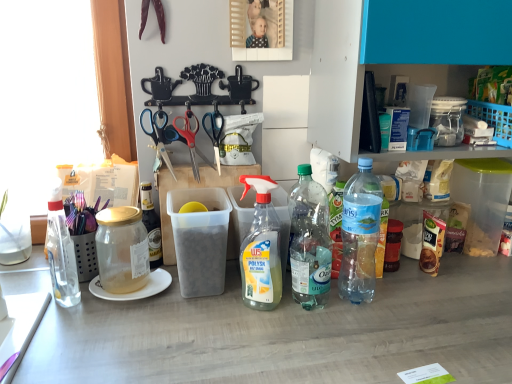
You are a GUI agent. You are given a task and a screenshot of the screen. Output one action in this format:
    pyautogui.click(x=<x>, y=<y>)
    Task: Click on the white ceramic plate at left
    Image resolution: width=512 pixels, height=384 pixels.
    Given the screenshot: What is the action you would take?
    pyautogui.click(x=137, y=290)

In order to face clear plastic bottle at center-right, placed as the 2th bottle when sorted from right to left, should I rotate leftwards or rightwards?

Rotate your view right by about 7.245°.

What do you see at coordinates (214, 133) in the screenshot? Image resolution: width=512 pixels, height=384 pixels. I see `black plastic scissors at center, the first scissors in the right-to-left sequence` at bounding box center [214, 133].

Measure the distance between point (263,241) and camera.

Point (263,241) is 37.48 inches away from camera.

The width and height of the screenshot is (512, 384). What do you see at coordinates (360, 234) in the screenshot?
I see `clear plastic bottle at center-right, the 1th bottle viewed from the right` at bounding box center [360, 234].

The height and width of the screenshot is (384, 512). In order to click on white ceramic plate at left in this screenshot , I will do `click(137, 290)`.

Considering the sizes of objects clear plastic bottle at center-right, marked as the 5th bottle in a left-to-right arrangement, and black plastic scissors at center, the first scissors in the right-to-left sequence, in the image provided, who is shorter, clear plastic bottle at center-right, marked as the 5th bottle in a left-to-right arrangement, or black plastic scissors at center, the first scissors in the right-to-left sequence,?

With less height is black plastic scissors at center, the first scissors in the right-to-left sequence.

Is clear plastic bottle at center-right, the 1th bottle viewed from the right, oriented towards black plastic scissors at center, the first scissors in the right-to-left sequence?

No.

Looking at this image, which is more to the right, clear plastic bottle at center-right, marked as the 5th bottle in a left-to-right arrangement, or black plastic scissors at center, the first scissors in the right-to-left sequence?

clear plastic bottle at center-right, marked as the 5th bottle in a left-to-right arrangement, is more to the right.

Can you tell me how much clear plastic bottle at center-right, the 1th bottle viewed from the right, and black plastic scissors at center, placed as the 3th scissors when sorted from left to right, differ in facing direction?

The angular difference between clear plastic bottle at center-right, the 1th bottle viewed from the right, and black plastic scissors at center, placed as the 3th scissors when sorted from left to right, is 22.5 degrees.

Can you confirm if clear plastic bottle at center-right, the 1th bottle viewed from the right, is taller than clear glass bottle at left, marked as the first bottle in a left-to-right arrangement?

Correct, clear plastic bottle at center-right, the 1th bottle viewed from the right, is much taller as clear glass bottle at left, marked as the first bottle in a left-to-right arrangement.

Considering their positions, is clear plastic bottle at center-right, marked as the 5th bottle in a left-to-right arrangement, located in front of or behind clear glass bottle at left, the fifth bottle in the right-to-left sequence?

In the image, clear plastic bottle at center-right, marked as the 5th bottle in a left-to-right arrangement, appears behind clear glass bottle at left, the fifth bottle in the right-to-left sequence.

From the image's perspective, is clear plastic bottle at center-right, the 1th bottle viewed from the right, on clear glass bottle at left, marked as the first bottle in a left-to-right arrangement?

Yes, from the image's perspective, clear plastic bottle at center-right, the 1th bottle viewed from the right, is on top of clear glass bottle at left, marked as the first bottle in a left-to-right arrangement.

How far apart are white ceramic plate at left and black plastic scissors at center, the first scissors in the right-to-left sequence?

14.84 inches.

Is white ceramic plate at left aimed at black plastic scissors at center, placed as the 3th scissors when sorted from left to right?

No, white ceramic plate at left is not aimed at black plastic scissors at center, placed as the 3th scissors when sorted from left to right.

Who is taller, white ceramic plate at left or black plastic scissors at center, the first scissors in the right-to-left sequence?

black plastic scissors at center, the first scissors in the right-to-left sequence.

Is white ceramic plate at left smaller than black plastic scissors at center, the first scissors in the right-to-left sequence?

Actually, white ceramic plate at left might be larger than black plastic scissors at center, the first scissors in the right-to-left sequence.

Considering the sizes of objects clear plastic bottle at center-right, the 1th bottle viewed from the right, and clear plastic bottle at center-right, which is counted as the 4th bottle, starting from the left, in the image provided, who is smaller, clear plastic bottle at center-right, the 1th bottle viewed from the right, or clear plastic bottle at center-right, which is counted as the 4th bottle, starting from the left,?

With smaller size is clear plastic bottle at center-right, which is counted as the 4th bottle, starting from the left.

Considering the relative sizes of clear plastic bottle at center-right, the 1th bottle viewed from the right, and clear plastic bottle at center-right, placed as the 2th bottle when sorted from right to left, in the image provided, is clear plastic bottle at center-right, the 1th bottle viewed from the right, wider than clear plastic bottle at center-right, placed as the 2th bottle when sorted from right to left,?

Yes, clear plastic bottle at center-right, the 1th bottle viewed from the right, is wider than clear plastic bottle at center-right, placed as the 2th bottle when sorted from right to left.

Which is behind, point (351, 266) or point (303, 175)?

The point (303, 175) is farther from the camera.

Measure the distance from clear plastic bottle at center-right, marked as the 5th bottle in a left-to-right arrangement, to clear plastic bottle at center-right, which is counted as the 4th bottle, starting from the left.

The distance of clear plastic bottle at center-right, marked as the 5th bottle in a left-to-right arrangement, from clear plastic bottle at center-right, which is counted as the 4th bottle, starting from the left, is 9.98 centimeters.

Is white ceramic plate at left smaller than clear plastic bottle at center, which appears as the 3th bottle when viewed from the right?

Yes.

Between white ceramic plate at left and clear plastic bottle at center, the 3th bottle in the left-to-right sequence, which one has less height?

With less height is white ceramic plate at left.

Which is closer to the camera, (x=167, y=281) or (x=264, y=201)?

Point (x=167, y=281) appears to be farther away from the viewer than point (x=264, y=201).

Would you say white ceramic plate at left is a long distance from clear plastic bottle at center, the 3th bottle in the left-to-right sequence?

No, white ceramic plate at left is not far away from clear plastic bottle at center, the 3th bottle in the left-to-right sequence.

Considering the sizes of objects clear plastic bottle at center-right, placed as the 2th bottle when sorted from right to left, and clear plastic bottle at center-right, marked as the 5th bottle in a left-to-right arrangement, in the image provided, who is smaller, clear plastic bottle at center-right, placed as the 2th bottle when sorted from right to left, or clear plastic bottle at center-right, marked as the 5th bottle in a left-to-right arrangement,?

With smaller size is clear plastic bottle at center-right, placed as the 2th bottle when sorted from right to left.

Is clear plastic bottle at center-right, which is counted as the 4th bottle, starting from the left, far away from clear plastic bottle at center-right, the 1th bottle viewed from the right?

No, clear plastic bottle at center-right, which is counted as the 4th bottle, starting from the left, is not far from clear plastic bottle at center-right, the 1th bottle viewed from the right.

Is clear plastic bottle at center-right, which is counted as the 4th bottle, starting from the left, facing towards clear plastic bottle at center-right, the 1th bottle viewed from the right?

No, clear plastic bottle at center-right, which is counted as the 4th bottle, starting from the left, is not oriented towards clear plastic bottle at center-right, the 1th bottle viewed from the right.

Does point (292, 275) come behind point (346, 234)?

No, (292, 275) is closer to viewer.

Does clear plastic bottle at center, which appears as the 3th bottle when viewed from the right, touch clear plastic bottle at center-right, which is counted as the 4th bottle, starting from the left?

Yes, clear plastic bottle at center, which appears as the 3th bottle when viewed from the right, is next to clear plastic bottle at center-right, which is counted as the 4th bottle, starting from the left.

Is clear plastic bottle at center, which appears as the 3th bottle when viewed from the right, situated inside clear plastic bottle at center-right, which is counted as the 4th bottle, starting from the left, or outside?

clear plastic bottle at center, which appears as the 3th bottle when viewed from the right, is not enclosed by clear plastic bottle at center-right, which is counted as the 4th bottle, starting from the left.

Considering the relative sizes of clear plastic bottle at center, the 3th bottle in the left-to-right sequence, and clear plastic bottle at center-right, which is counted as the 4th bottle, starting from the left, in the image provided, is clear plastic bottle at center, the 3th bottle in the left-to-right sequence, thinner than clear plastic bottle at center-right, which is counted as the 4th bottle, starting from the left,?

Yes.

Considering the sizes of clear plastic bottle at center, the 3th bottle in the left-to-right sequence, and clear plastic bottle at center-right, which is counted as the 4th bottle, starting from the left, in the image, is clear plastic bottle at center, the 3th bottle in the left-to-right sequence, bigger or smaller than clear plastic bottle at center-right, which is counted as the 4th bottle, starting from the left,?

Clearly, clear plastic bottle at center, the 3th bottle in the left-to-right sequence, is smaller in size than clear plastic bottle at center-right, which is counted as the 4th bottle, starting from the left.

You are a GUI agent. You are given a task and a screenshot of the screen. Output one action in this format:
    pyautogui.click(x=<x>, y=<y>)
    Task: Click on the 3rd scissors behind the clear plastic bottle at center-right, the 1th bottle viewed from the right
    The height and width of the screenshot is (384, 512).
    Given the screenshot: What is the action you would take?
    pyautogui.click(x=214, y=133)

From the clear glass bottle at left, marked as the first bottle in a left-to-right arrangement, count 4th bottle to the right and point to it. Please provide its 2D coordinates.

[(360, 234)]

From the picture: When comparing their distances from clear plastic bottle at center, which appears as the 3th bottle when viewed from the right, does clear plastic bottle at center-right, marked as the 5th bottle in a left-to-right arrangement, or red plastic scissors at center, which is the second scissors from left to right, seem closer?

Based on the image, clear plastic bottle at center-right, marked as the 5th bottle in a left-to-right arrangement, appears to be nearer to clear plastic bottle at center, which appears as the 3th bottle when viewed from the right.

Looking at this image, based on their spatial positions, is blue plastic scissors at upper center, the 3th scissors positioned from the right, or clear plastic bottle at center-right, which is counted as the 4th bottle, starting from the left, further from transparent glass jar at left, which ranks as the fourth bottle in right-to-left order?

clear plastic bottle at center-right, which is counted as the 4th bottle, starting from the left, lies further to transparent glass jar at left, which ranks as the fourth bottle in right-to-left order, than the other object.

Estimate the real-world distances between objects in this image. Which object is closer to white ceramic plate at left, transparent glass jar at left, which ranks as the fourth bottle in right-to-left order, or red plastic scissors at center, which is the second scissors from left to right?

transparent glass jar at left, which ranks as the fourth bottle in right-to-left order, lies closer to white ceramic plate at left than the other object.

From the picture: Looking at the image, which one is located closer to red plastic scissors at center, which is the 2th scissors from right to left, clear plastic bottle at center-right, the 1th bottle viewed from the right, or clear plastic bottle at center-right, which is counted as the 4th bottle, starting from the left?

clear plastic bottle at center-right, which is counted as the 4th bottle, starting from the left.

Looking at the image, which one is located closer to blue plastic scissors at upper center, the 3th scissors positioned from the right, black plastic scissors at center, the first scissors in the right-to-left sequence, or clear plastic bottle at center, which appears as the 3th bottle when viewed from the right?

black plastic scissors at center, the first scissors in the right-to-left sequence.

Looking at the image, which one is located further to white ceramic plate at left, red plastic scissors at center, which is the 2th scissors from right to left, or black plastic scissors at center, placed as the 3th scissors when sorted from left to right?

black plastic scissors at center, placed as the 3th scissors when sorted from left to right.

Consider the image. When comparing their distances from white ceramic plate at left, does clear plastic bottle at center-right, the 1th bottle viewed from the right, or clear plastic bottle at center-right, which is counted as the 4th bottle, starting from the left, seem closer?

Among the two, clear plastic bottle at center-right, which is counted as the 4th bottle, starting from the left, is located nearer to white ceramic plate at left.

Based on their spatial positions, is clear plastic bottle at center, the 3th bottle in the left-to-right sequence, or transparent glass jar at left, marked as the second bottle in a left-to-right arrangement, closer to clear plastic bottle at center-right, marked as the 5th bottle in a left-to-right arrangement?

Among the two, clear plastic bottle at center, the 3th bottle in the left-to-right sequence, is located nearer to clear plastic bottle at center-right, marked as the 5th bottle in a left-to-right arrangement.

Image resolution: width=512 pixels, height=384 pixels. I want to click on bottle between clear glass bottle at left, the fifth bottle in the right-to-left sequence, and white ceramic plate at left, so click(122, 249).

This screenshot has width=512, height=384. In order to click on bottle between clear glass bottle at left, the fifth bottle in the right-to-left sequence, and clear plastic bottle at center, the 3th bottle in the left-to-right sequence, from left to right in this screenshot , I will do `click(122, 249)`.

This screenshot has width=512, height=384. Identify the location of scissors between red plastic scissors at center, which is the 2th scissors from right to left, and clear plastic bottle at center-right, marked as the 5th bottle in a left-to-right arrangement, from left to right. (214, 133).

The height and width of the screenshot is (384, 512). Find the location of `bottle located between blue plastic scissors at upper center, the 3th scissors positioned from the right, and clear plastic bottle at center-right, which is counted as the 4th bottle, starting from the left, in the left-right direction`. bottle located between blue plastic scissors at upper center, the 3th scissors positioned from the right, and clear plastic bottle at center-right, which is counted as the 4th bottle, starting from the left, in the left-right direction is located at coordinates (261, 248).